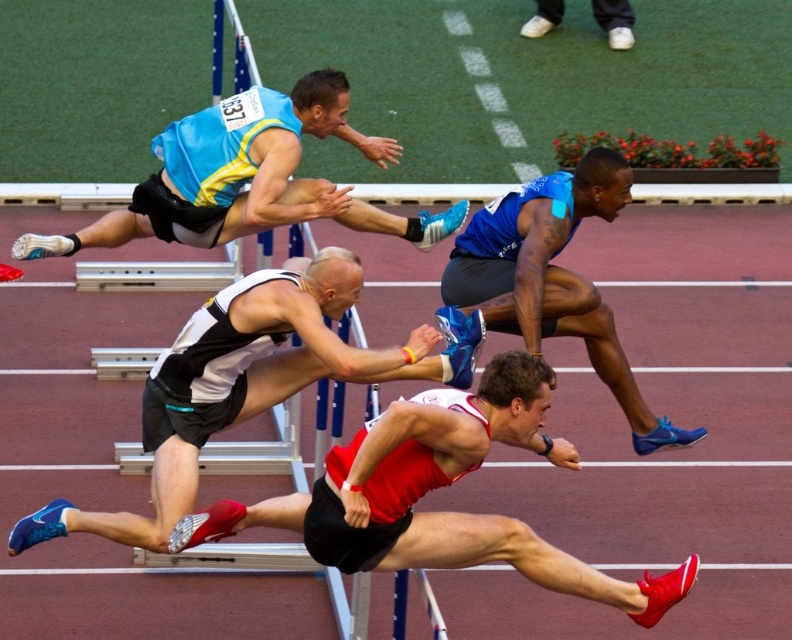
What do you see at coordinates (433, 488) in the screenshot? I see `red matte running shoe at center` at bounding box center [433, 488].

Which of these two, red matte running shoe at center or white matte shoes at upper center, stands taller?

red matte running shoe at center is taller.

Image resolution: width=792 pixels, height=640 pixels. I want to click on red matte running shoe at center, so click(433, 488).

Locate an element on the screen. The image size is (792, 640). red matte running shoe at center is located at coordinates (433, 488).

Does red matte running shoe at center lie in front of blue matte shorts at center?

Yes, red matte running shoe at center is closer to the viewer.

Does point (305, 525) lie behind point (469, 280)?

No, (305, 525) is in front of (469, 280).

Where is `red matte running shoe at center`? The height and width of the screenshot is (640, 792). red matte running shoe at center is located at coordinates (433, 488).

From the picture: Who is positioned more to the left, blue matte shorts at center or white matte shoes at upper center?

From the viewer's perspective, blue matte shorts at center appears more on the left side.

You are a GUI agent. You are given a task and a screenshot of the screen. Output one action in this format:
    pyautogui.click(x=<x>, y=<y>)
    Task: Click on the blue matte shorts at center
    The image size is (792, 640).
    Given the screenshot: What is the action you would take?
    pyautogui.click(x=547, y=280)